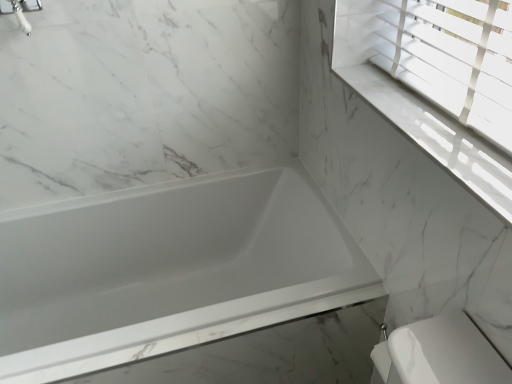
Identify the location of white glossy bathtub at center. (169, 271).

Locate an element on the screen. The width and height of the screenshot is (512, 384). silver metallic faucet at upper left is located at coordinates (20, 11).

What are the coordinates of `white glossy bathtub at center` in the screenshot? It's located at (169, 271).

How many degrees apart are the facing directions of white glossy bathtub at center and white marble window sill at upper right?

The angular difference between white glossy bathtub at center and white marble window sill at upper right is 89.6 degrees.

Choose the correct answer: Is white glossy bathtub at center inside white marble window sill at upper right or outside it?

white glossy bathtub at center is not inside white marble window sill at upper right, it's outside.

From the image's perspective, between white glossy bathtub at center and white marble window sill at upper right, which one is located above?

From the image's view, white marble window sill at upper right is above.

Is white glossy bathtub at center turned away from white marble window sill at upper right?

No, white marble window sill at upper right is not at the back of white glossy bathtub at center.

From their relative heights in the image, would you say white glossy bathtub at center is taller or shorter than silver metallic faucet at upper left?

Clearly, white glossy bathtub at center is taller compared to silver metallic faucet at upper left.

Considering the positions of points (347, 283) and (7, 9), is point (347, 283) farther from camera compared to point (7, 9)?

Yes.

Is white glossy bathtub at center inside or outside of silver metallic faucet at upper left?

white glossy bathtub at center is outside silver metallic faucet at upper left.

Would you say white glossy bathtub at center is a long distance from silver metallic faucet at upper left?

white glossy bathtub at center is near silver metallic faucet at upper left, not far away.

Between point (21, 5) and point (381, 83), which one is positioned behind?

Positioned behind is point (381, 83).

Is silver metallic faucet at upper left surrounding white marble window sill at upper right?

Actually, white marble window sill at upper right is outside silver metallic faucet at upper left.

From their relative heights in the image, would you say silver metallic faucet at upper left is taller or shorter than white marble window sill at upper right?

Clearly, silver metallic faucet at upper left is taller compared to white marble window sill at upper right.

Which is more to the right, white marble window sill at upper right or silver metallic faucet at upper left?

Positioned to the right is white marble window sill at upper right.

Does white marble window sill at upper right have a greater width compared to silver metallic faucet at upper left?

Yes, white marble window sill at upper right is wider than silver metallic faucet at upper left.

Is point (475, 171) closer to viewer compared to point (14, 4)?

Yes, point (475, 171) is closer to viewer.

Is white marble window sill at upper right in front of or behind silver metallic faucet at upper left in the image?

white marble window sill at upper right is in front of silver metallic faucet at upper left.

Is white marble window sill at upper right to the left of white glossy bathtub at center from the viewer's perspective?

No.

Based on their sizes in the image, would you say white marble window sill at upper right is bigger or smaller than white glossy bathtub at center?

Clearly, white marble window sill at upper right is smaller in size than white glossy bathtub at center.

Is white marble window sill at upper right not close to white glossy bathtub at center?

Actually, white marble window sill at upper right and white glossy bathtub at center are a little close together.

Based on the photo, from a real-world perspective, is white marble window sill at upper right on top of white glossy bathtub at center?

Indeed, from a real-world perspective, white marble window sill at upper right stands above white glossy bathtub at center.

Considering the points (28, 7) and (173, 220), which point is in front, point (28, 7) or point (173, 220)?

The point (28, 7) is more forward.

Is silver metallic faucet at upper left smaller than white glossy bathtub at center?

Yes, silver metallic faucet at upper left is smaller than white glossy bathtub at center.

How different are the orientations of silver metallic faucet at upper left and white glossy bathtub at center in degrees?

They differ by 0.905 degrees in their facing directions.

From the image's perspective, does silver metallic faucet at upper left appear lower than white glossy bathtub at center?

No.

You are a GUI agent. You are given a task and a screenshot of the screen. Output one action in this format:
    pyautogui.click(x=<x>, y=<y>)
    Task: Click on the bathtub on the left of white marble window sill at upper right
    Image resolution: width=512 pixels, height=384 pixels.
    Given the screenshot: What is the action you would take?
    pyautogui.click(x=169, y=271)

The width and height of the screenshot is (512, 384). In order to click on faucet behind the white glossy bathtub at center in this screenshot , I will do `click(20, 11)`.

Looking at the image, which one is located closer to white marble window sill at upper right, silver metallic faucet at upper left or white glossy bathtub at center?

white glossy bathtub at center.

When comparing their distances from silver metallic faucet at upper left, does white marble window sill at upper right or white glossy bathtub at center seem further?

white marble window sill at upper right is further to silver metallic faucet at upper left.

Based on their spatial positions, is white marble window sill at upper right or silver metallic faucet at upper left further from white glossy bathtub at center?

silver metallic faucet at upper left is positioned further to the anchor white glossy bathtub at center.

Estimate the real-world distances between objects in this image. Which object is closer to white glossy bathtub at center, silver metallic faucet at upper left or white marble window sill at upper right?

white marble window sill at upper right is positioned closer to the anchor white glossy bathtub at center.

Based on their spatial positions, is white glossy bathtub at center or white marble window sill at upper right closer to silver metallic faucet at upper left?

white glossy bathtub at center.

Estimate the real-world distances between objects in this image. Which object is closer to white marble window sill at upper right, white glossy bathtub at center or silver metallic faucet at upper left?

white glossy bathtub at center lies closer to white marble window sill at upper right than the other object.

This screenshot has width=512, height=384. In order to click on bathtub located between silver metallic faucet at upper left and white marble window sill at upper right in the left-right direction in this screenshot , I will do `click(169, 271)`.